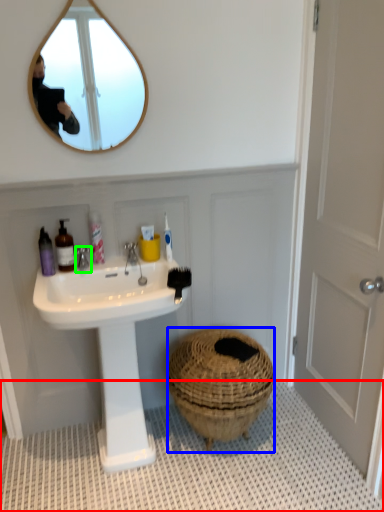
Question: Based on their relative distances, which object is nearer to bath mat (highlighted by a red box)? Choose from basket (highlighted by a blue box) and tap (highlighted by a green box).

Choices:
 (A) basket
 (B) tap

Answer: (A)